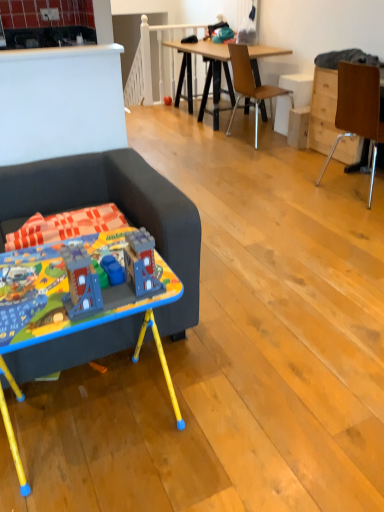
Question: Which direction should I rotate to face brown wooden chair at center, which is the 1th chair from back to front, — up or down?

Choices:
 (A) down
 (B) up

Answer: (B)

Question: Does matte plastic toy at center, which appears as the 1th toy when viewed from the back, appear on the left side of plastic toy castle at left, which is the 2th toy in top-to-bottom order?

Choices:
 (A) yes
 (B) no

Answer: (A)

Question: From the image's perspective, is matte plastic toy at center, which appears as the second toy when viewed from the front, below plastic toy castle at left, which is the 2th toy in back-to-front order?

Choices:
 (A) yes
 (B) no

Answer: (B)

Question: Does matte plastic toy at center, which appears as the 1th toy when viewed from the back, have a smaller size compared to plastic toy castle at left, which is the 2th toy in top-to-bottom order?

Choices:
 (A) yes
 (B) no

Answer: (A)

Question: From a real-world perspective, is matte plastic toy at center, which is the 1th toy in top-to-bottom order, on plastic toy castle at left, which is the 2th toy in top-to-bottom order?

Choices:
 (A) no
 (B) yes

Answer: (A)

Question: Is matte plastic toy at center, which appears as the second toy when viewed from the front, further to camera compared to plastic toy castle at left, which is the 2th toy in top-to-bottom order?

Choices:
 (A) yes
 (B) no

Answer: (A)

Question: From the image's perspective, is matte plastic toy at center, which appears as the 1th toy when viewed from the back, on plastic toy castle at left, the first toy from the front?

Choices:
 (A) no
 (B) yes

Answer: (B)

Question: Does brown wooden chair at center, which is the 1th chair from back to front, have a smaller size compared to blue plastic desk at lower left?

Choices:
 (A) yes
 (B) no

Answer: (B)

Question: From the image's perspective, is brown wooden chair at center, which ranks as the second chair in right-to-left order, on top of blue plastic desk at lower left?

Choices:
 (A) yes
 (B) no

Answer: (A)

Question: Is brown wooden chair at center, which is the 1th chair from back to front, shorter than blue plastic desk at lower left?

Choices:
 (A) yes
 (B) no

Answer: (B)

Question: From a real-world perspective, is brown wooden chair at center, acting as the first chair starting from the left, on top of blue plastic desk at lower left?

Choices:
 (A) yes
 (B) no

Answer: (A)

Question: Does brown wooden chair at center, positioned as the 2th chair in front-to-back order, have a greater width compared to blue plastic desk at lower left?

Choices:
 (A) yes
 (B) no

Answer: (A)

Question: Considering the relative positions of brown wooden chair at center, which ranks as the second chair in right-to-left order, and blue plastic desk at lower left in the image provided, is brown wooden chair at center, which ranks as the second chair in right-to-left order, in front of blue plastic desk at lower left?

Choices:
 (A) no
 (B) yes

Answer: (A)

Question: From a real-world perspective, does wooden drawer at right sit lower than dark gray fabric couch at left?

Choices:
 (A) yes
 (B) no

Answer: (A)